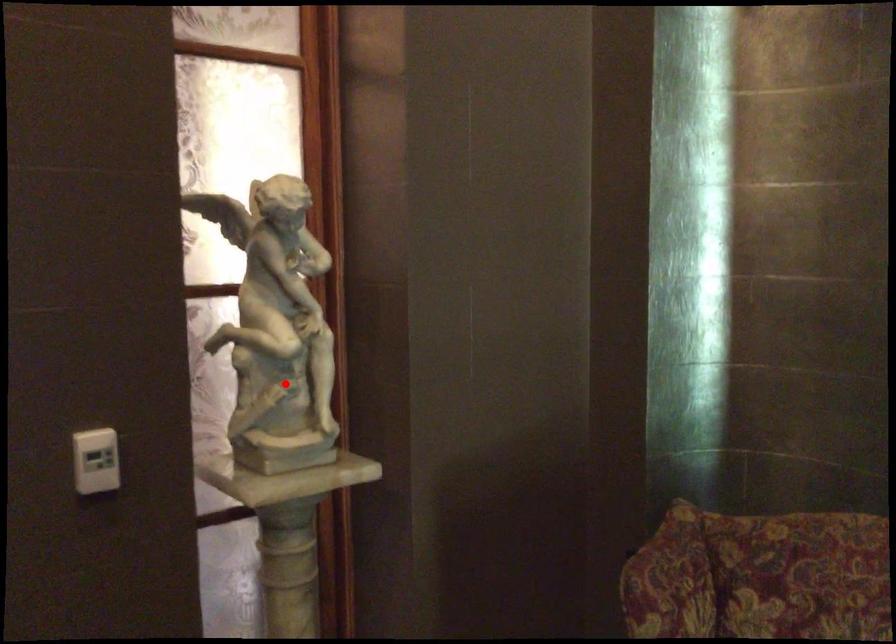
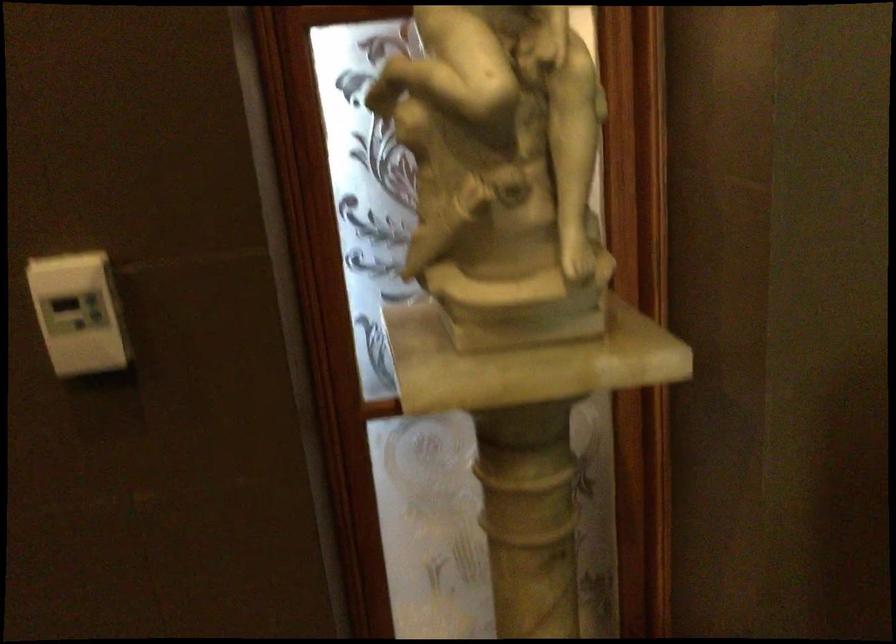
In the second image, find the point that corresponds to the highlighted location in the first image.

(502, 172)